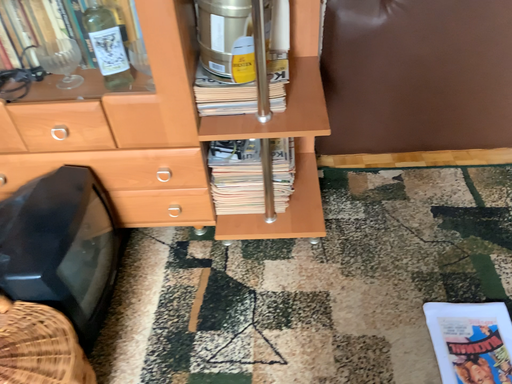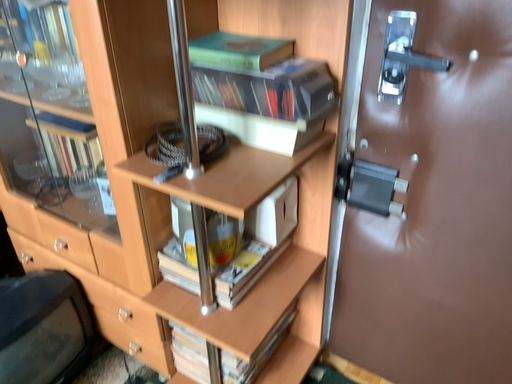
Question: Which way did the camera rotate in the video?

Choices:
 (A) rotated upward
 (B) rotated downward

Answer: (A)